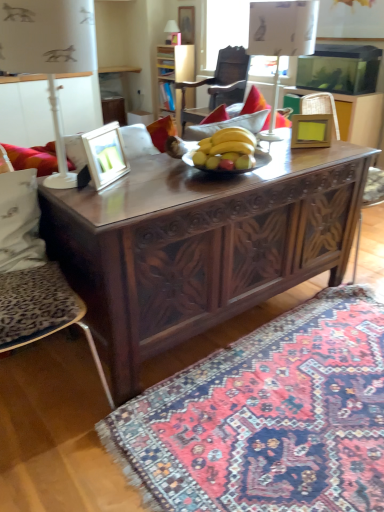
Where is `matte white lampshade at upper center, arranged as the first lamp when viewed from the top`? Image resolution: width=384 pixels, height=512 pixels. matte white lampshade at upper center, arranged as the first lamp when viewed from the top is located at coordinates (172, 33).

This screenshot has width=384, height=512. What are the coordinates of `dark wood carved dresser at upper center` in the screenshot? It's located at (174, 76).

What do you see at coordinates (199, 245) in the screenshot? This screenshot has width=384, height=512. I see `dark wood carved table at center` at bounding box center [199, 245].

Measure the distance between wooden photo frame at center, the first picture frame when ordered from right to left, and camera.

A distance of 6.45 feet exists between wooden photo frame at center, the first picture frame when ordered from right to left, and camera.

Locate an element on the screen. matte wooden picture frame at left, the first picture frame positioned from the front is located at coordinates (103, 157).

How much space does wooden chair at center, which appears as the second chair when ordered from the bottom, occupy horizontally?

wooden chair at center, which appears as the second chair when ordered from the bottom, is 25.92 inches in width.

Locate an element on the screen. The width and height of the screenshot is (384, 512). leopard print cushion at left, marked as the first chair in a left-to-right arrangement is located at coordinates (41, 309).

At what (x,y) coordinates should I click in order to perform the action: click on matte white lampshade at upper center, acting as the third lamp starting from the front. Please return your answer as a coordinate pair (x, y). The width and height of the screenshot is (384, 512). Looking at the image, I should click on (172, 33).

Locate an element on the screen. The width and height of the screenshot is (384, 512). the 2nd chair counting from the left of the wooden photo frame at center, which is the second picture frame in back-to-front order is located at coordinates (41, 309).

Relative to wooden photo frame at center, placed as the 2th picture frame when sorted from front to back, is leopard print cushion at left, marked as the first chair in a left-to-right arrangement, in front or behind?

Visually, leopard print cushion at left, marked as the first chair in a left-to-right arrangement, is located in front of wooden photo frame at center, placed as the 2th picture frame when sorted from front to back.

Between leopard print cushion at left, which is the 2th chair from back to front, and wooden photo frame at center, which ranks as the 2th picture frame in bottom-to-top order, which one has smaller size?

Smaller between the two is wooden photo frame at center, which ranks as the 2th picture frame in bottom-to-top order.

Is white plastic lamp at upper center, arranged as the second lamp when viewed from the top, looking in the opposite direction of dark wood carved table at center?

white plastic lamp at upper center, arranged as the second lamp when viewed from the top, is not turned away from dark wood carved table at center.

Who is bigger, white plastic lamp at upper center, which is the 2th lamp in back-to-front order, or dark wood carved table at center?

dark wood carved table at center.

Consider the image. Is white plastic lamp at upper center, the third lamp when ordered from left to right, inside or outside of dark wood carved table at center?

white plastic lamp at upper center, the third lamp when ordered from left to right, is outside dark wood carved table at center.

From a real-world perspective, who is located lower, white plastic lamp at upper center, the third lamp when ordered from left to right, or dark wood carved table at center?

dark wood carved table at center, from a real-world perspective.

Considering the positions of point (186, 33) and point (214, 315), is point (186, 33) closer or farther from the camera than point (214, 315)?

Point (186, 33) is farther from the camera than point (214, 315).

Is wooden picture frame at upper center, placed as the third picture frame when sorted from front to back, positioned in front of dark wood carved table at center?

No.

From a real-world perspective, which is physically below, wooden picture frame at upper center, which ranks as the first picture frame in back-to-front order, or dark wood carved table at center?

From a 3D spatial view, dark wood carved table at center is below.

Are white plastic lamp at upper center, the second lamp positioned from the bottom, and leopard print cushion at left, marked as the first chair in a left-to-right arrangement, located far from each other?

Yes, white plastic lamp at upper center, the second lamp positioned from the bottom, is far from leopard print cushion at left, marked as the first chair in a left-to-right arrangement.

From a real-world perspective, who is located lower, white plastic lamp at upper center, which is the 1th lamp in right-to-left order, or leopard print cushion at left, which is the second chair from top to bottom?

leopard print cushion at left, which is the second chair from top to bottom, from a real-world perspective.

How many degrees apart are the facing directions of white plastic lamp at upper center, arranged as the second lamp when viewed from the top, and leopard print cushion at left, the 1th chair ordered from the bottom?

The angle between the facing direction of white plastic lamp at upper center, arranged as the second lamp when viewed from the top, and the facing direction of leopard print cushion at left, the 1th chair ordered from the bottom, is 1.44 degrees.

Which object is positioned more to the left, white plastic lamp at upper center, placed as the 2th lamp when sorted from front to back, or leopard print cushion at left, which is the 2th chair from back to front?

leopard print cushion at left, which is the 2th chair from back to front, is more to the left.

Measure the distance from carpet with intricate patterns at lower right to matte white lampshade at upper center, acting as the second lamp starting from the left.

A distance of 4.46 meters exists between carpet with intricate patterns at lower right and matte white lampshade at upper center, acting as the second lamp starting from the left.

Does carpet with intricate patterns at lower right have a lesser height compared to matte white lampshade at upper center, acting as the second lamp starting from the left?

Yes.

Is carpet with intricate patterns at lower right bigger than matte white lampshade at upper center, which appears as the 2th lamp when viewed from the right?

Indeed, carpet with intricate patterns at lower right has a larger size compared to matte white lampshade at upper center, which appears as the 2th lamp when viewed from the right.

From the picture: Is carpet with intricate patterns at lower right not close to matte white lampshade at upper center, which is the first lamp in back-to-front order?

Yes, carpet with intricate patterns at lower right and matte white lampshade at upper center, which is the first lamp in back-to-front order, are located far from each other.

Which object is thinner, white plastic lamp at upper center, which is the 1th lamp in right-to-left order, or carpet with intricate patterns at lower right?

Thinner between the two is white plastic lamp at upper center, which is the 1th lamp in right-to-left order.

Which is behind, point (316, 2) or point (264, 508)?

Positioned behind is point (316, 2).

In terms of size, does white plastic lamp at upper center, which is the 1th lamp in right-to-left order, appear bigger or smaller than carpet with intricate patterns at lower right?

Clearly, white plastic lamp at upper center, which is the 1th lamp in right-to-left order, is smaller in size than carpet with intricate patterns at lower right.

Considering the sizes of white plastic lamp at upper center, placed as the 2th lamp when sorted from front to back, and carpet with intricate patterns at lower right in the image, is white plastic lamp at upper center, placed as the 2th lamp when sorted from front to back, taller or shorter than carpet with intricate patterns at lower right?

Considering their sizes, white plastic lamp at upper center, placed as the 2th lamp when sorted from front to back, has more height than carpet with intricate patterns at lower right.

Does matte wooden picture frame at left, the first picture frame positioned from the front, turn towards wooden chair at center, which ranks as the 1th chair in back-to-front order?

No, matte wooden picture frame at left, the first picture frame positioned from the front, is not oriented towards wooden chair at center, which ranks as the 1th chair in back-to-front order.

Considering the sizes of objects matte wooden picture frame at left, which ranks as the third picture frame in back-to-front order, and wooden chair at center, which appears as the second chair when viewed from the left, in the image provided, who is bigger, matte wooden picture frame at left, which ranks as the third picture frame in back-to-front order, or wooden chair at center, which appears as the second chair when viewed from the left,?

With larger size is wooden chair at center, which appears as the second chair when viewed from the left.

Identify the location of chair above the matte wooden picture frame at left, the first picture frame positioned from the front (from the image's perspective). The height and width of the screenshot is (512, 384). (219, 84).

Identify the location of chair below the wooden photo frame at center, placed as the 2th picture frame when sorted from top to bottom (from the image's perspective). The width and height of the screenshot is (384, 512). (41, 309).

From a real-world perspective, starting from the dark wood carved table at center, which lamp is the 1st one vertically above it? Please provide its 2D coordinates.

[(282, 37)]

From the image, which object appears to be nearer to matte wooden picture frame at left, the 1th picture frame positioned from the bottom, leopard print cushion at left, which is the 2th chair from back to front, or wooden picture frame at upper center, arranged as the 1th picture frame when viewed from the top?

leopard print cushion at left, which is the 2th chair from back to front, lies closer to matte wooden picture frame at left, the 1th picture frame positioned from the bottom, than the other object.

When comparing their distances from dark wood carved table at center, does matte wooden picture frame at left, the 1th picture frame positioned from the bottom, or white plastic lamp at left, which appears as the 1th lamp when viewed from the front, seem closer?

The object closer to dark wood carved table at center is matte wooden picture frame at left, the 1th picture frame positioned from the bottom.

From the image, which object appears to be farther from dark wood carved table at center, white fabric pillow at left or wooden chair at center, which ranks as the 1th chair in top-to-bottom order?

The object further to dark wood carved table at center is wooden chair at center, which ranks as the 1th chair in top-to-bottom order.

Based on the photo, from the image, which object appears to be farther from white plastic lamp at left, which is the 1th lamp from left to right, dark wood carved dresser at upper center or carpet with intricate patterns at lower right?

dark wood carved dresser at upper center is further to white plastic lamp at left, which is the 1th lamp from left to right.

Looking at this image, based on their spatial positions, is wooden photo frame at center, which is the second picture frame in back-to-front order, or dark wood carved table at center closer to leopard print cushion at left, marked as the first chair in a front-to-back arrangement?

dark wood carved table at center.

Which object lies nearer to the anchor point dark wood carved table at center, matte wooden picture frame at left, arranged as the 3th picture frame when viewed from the right, or dark wood carved dresser at upper center?

matte wooden picture frame at left, arranged as the 3th picture frame when viewed from the right, is closer to dark wood carved table at center.

Which object lies nearer to the anchor point white plastic lamp at left, placed as the 3th lamp when sorted from back to front, leopard print cushion at left, which is the 2th chair from back to front, or matte white lampshade at upper center, arranged as the first lamp when viewed from the top?

leopard print cushion at left, which is the 2th chair from back to front.

Estimate the real-world distances between objects in this image. Which object is closer to dark wood carved dresser at upper center, dark wood carved table at center or matte wooden picture frame at left, arranged as the 3th picture frame when viewed from the right?

The object closer to dark wood carved dresser at upper center is matte wooden picture frame at left, arranged as the 3th picture frame when viewed from the right.

At what (x,y) coordinates should I click in order to perform the action: click on lamp located between dark wood carved table at center and matte white lampshade at upper center, which is the first lamp in back-to-front order, in the depth direction. Please return your answer as a coordinate pair (x, y). The image size is (384, 512). Looking at the image, I should click on (282, 37).

Locate an element on the screen. picture frame located between wooden chair at center, which appears as the second chair when ordered from the bottom, and matte white lampshade at upper center, arranged as the first lamp when viewed from the top, in the depth direction is located at coordinates (187, 24).

In order to click on dresser located between white fabric pillow at left and matte white lampshade at upper center, which appears as the 2th lamp when viewed from the right, in the depth direction in this screenshot , I will do `click(174, 76)`.

The image size is (384, 512). I want to click on lamp between white plastic lamp at upper center, the third lamp when ordered from left to right, and carpet with intricate patterns at lower right from top to bottom, so point(49,53).